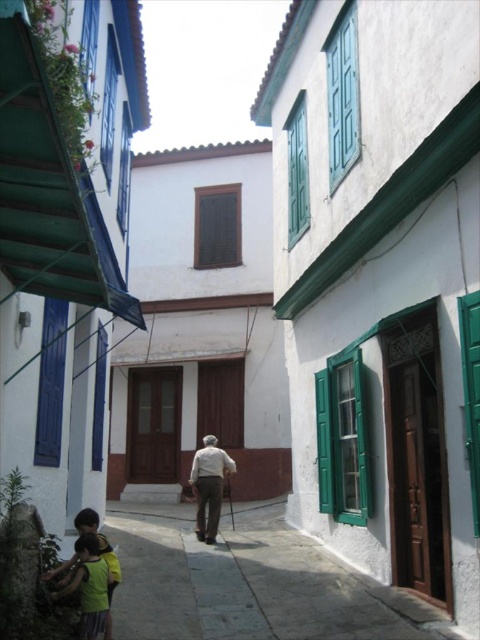
You are a painter who needs to decide which item to paint first. The green painted wood at upper center and the yellow cotton shirt at lower left are both in your view. Which item requires a smaller amount of paint due to its size?

The green painted wood at upper center requires less paint because it is thinner than the yellow cotton shirt at lower left.

You are a delivery person with a cart that is 1.2 meters wide. You need to navigate through the narrow street scene shown in the image. Can your cart fit through the space between the smooth stone pavement at lower left and the green painted wood at upper center? Please explain your reasoning based on the scene description.

The smooth stone pavement at lower left might be wider than green painted wood at upper center. However, since the exact width isn not provided, it is uncertain if the cart can fit. Proceed with caution and check the space physically before proceeding.

You are standing at the point with coordinates point (336, 148) and want to walk to the point with coordinates point (135, 580). According to the scene, which direction should you move to reach your destination?

Point (135, 580) is in front of point (336, 148), so you should move forward to reach your destination.